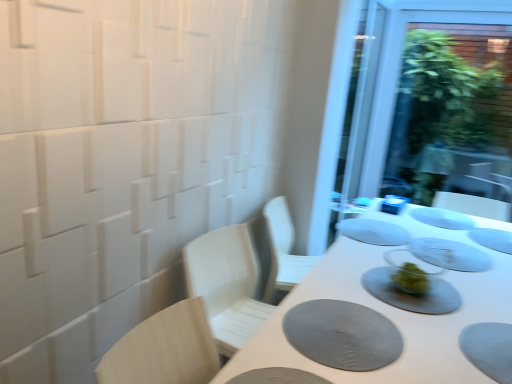
Question: Is white matte table at center not within light wood chair at left?

Choices:
 (A) yes
 (B) no

Answer: (A)

Question: From the image's perspective, is white matte table at center above light wood chair at left?

Choices:
 (A) no
 (B) yes

Answer: (A)

Question: From a real-world perspective, is white matte table at center positioned under light wood chair at left based on gravity?

Choices:
 (A) yes
 (B) no

Answer: (A)

Question: Is white matte table at center bigger than light wood chair at left?

Choices:
 (A) no
 (B) yes

Answer: (B)

Question: Considering the relative sizes of white matte table at center and light wood chair at left in the image provided, is white matte table at center shorter than light wood chair at left?

Choices:
 (A) yes
 (B) no

Answer: (B)

Question: Is white matte table at center to the left of light wood chair at left from the viewer's perspective?

Choices:
 (A) no
 (B) yes

Answer: (A)

Question: Is white matte plate at center, arranged as the 2th tableware when viewed from the back, outside transparent glass screen door at upper right?

Choices:
 (A) yes
 (B) no

Answer: (A)

Question: Does white matte plate at center, arranged as the 2th tableware when viewed from the back, have a larger size compared to transparent glass screen door at upper right?

Choices:
 (A) yes
 (B) no

Answer: (B)

Question: Is white matte plate at center, the 5th tableware viewed from the front, wider than transparent glass screen door at upper right?

Choices:
 (A) no
 (B) yes

Answer: (B)

Question: Is transparent glass screen door at upper right at the back of white matte plate at center, arranged as the 2th tableware when viewed from the back?

Choices:
 (A) yes
 (B) no

Answer: (B)

Question: From a real-world perspective, does white matte plate at center, arranged as the 2th tableware when viewed from the back, stand above transparent glass screen door at upper right?

Choices:
 (A) no
 (B) yes

Answer: (A)

Question: Is the position of white matte plate at center, arranged as the 2th tableware when viewed from the back, more distant than that of transparent glass screen door at upper right?

Choices:
 (A) yes
 (B) no

Answer: (B)

Question: Is there a large distance between gray matte placemat at center, positioned as the 3th tableware in front-to-back order, and gray textured placemat at lower right?

Choices:
 (A) yes
 (B) no

Answer: (A)